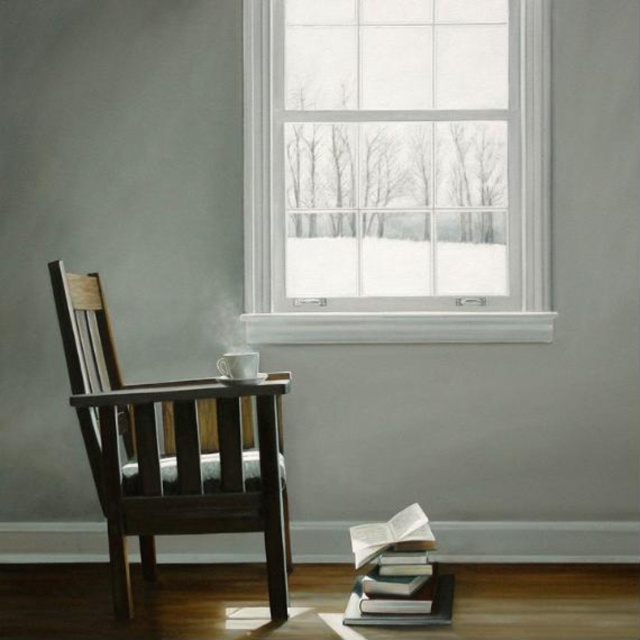
You are a delivery robot with a 1.2 meter long package. You need to move from the entrance to the area near the white glass window at upper center. There is an obstacle in the path, which is the hardcover books at lower right. Can you navigate around the books to reach the window without dropping the package?

The distance between the white glass window at upper center and the hardcover books at lower right is 1.36 meters. Since your package is 1.2 meters long, you have enough space to maneuver around the books and reach the window safely.

Looking at this image, you are standing in the room and want to place a new painting on the wall. The painting must be placed directly to the right of the white glass window at upper center. According to the scene description, where should you position the painting?

The white glass window at upper center is located at point [396,170], so you should position the painting to the right of this coordinate.

You are sitting in the dark wood armchair at left and want to look out the white glass window at upper center. In which direction should you turn your head?

You should turn your head to the right because the white glass window at upper center is to the right of the dark wood armchair at left.